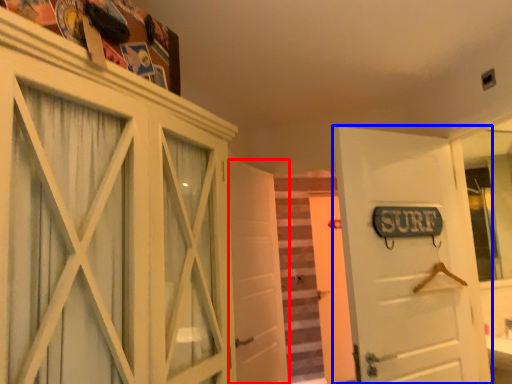
Question: Among these objects, which one is farthest to the camera, door (highlighted by a red box) or door (highlighted by a blue box)?

Choices:
 (A) door
 (B) door

Answer: (A)